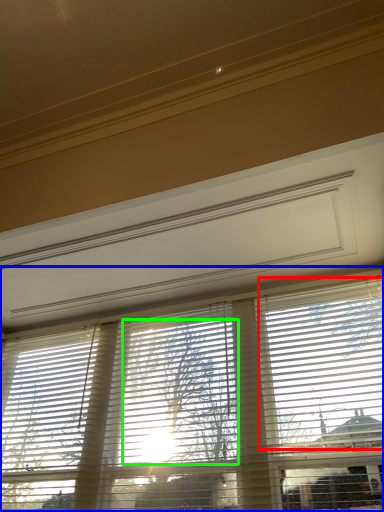
Question: Based on their relative distances, which object is nearer to blind (highlighted by a red box)? Choose from window blind (highlighted by a blue box) and tree (highlighted by a green box).

Choices:
 (A) window blind
 (B) tree

Answer: (A)